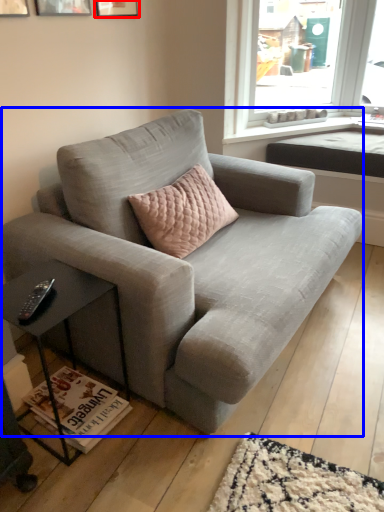
Question: Which point is further to the camera, picture frame (highlighted by a red box) or studio couch (highlighted by a blue box)?

Choices:
 (A) picture frame
 (B) studio couch

Answer: (A)